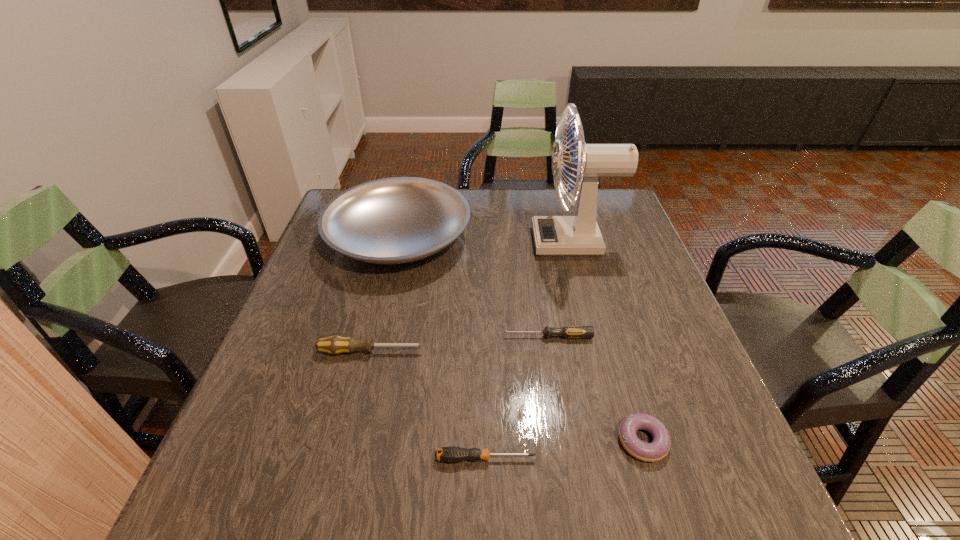
In the image, there is a desktop. At what (x,y) coordinates should I click in order to perform the action: click on vacant region at the near right corner. Please return your answer as a coordinate pair (x, y). The width and height of the screenshot is (960, 540). Looking at the image, I should click on (741, 496).

You are a GUI agent. You are given a task and a screenshot of the screen. Output one action in this format:
    pyautogui.click(x=<x>, y=<y>)
    Task: Click on the free spot between the doughnut and the tallest screwdriver
    The height and width of the screenshot is (540, 960).
    Given the screenshot: What is the action you would take?
    pyautogui.click(x=507, y=396)

I want to click on free spot between the fourth nearest object and the tallest object, so coord(561,289).

Locate an element on the screen. Image resolution: width=960 pixels, height=540 pixels. empty location between the doughnut and the nearest screwdriver is located at coordinates (564, 450).

Where is `free space that is in between the doughnut and the farthest screwdriver`? The image size is (960, 540). free space that is in between the doughnut and the farthest screwdriver is located at coordinates (595, 389).

Identify the location of free spot between the fourth shortest object and the farthest screwdriver. (460, 344).

Locate an element on the screen. This screenshot has width=960, height=540. empty space between the doughnut and the third tallest object is located at coordinates (507, 396).

Image resolution: width=960 pixels, height=540 pixels. I want to click on free space between the nearest screwdriver and the leftmost screwdriver, so click(x=428, y=405).

Find the location of a particular element. vacant space that's between the nearest screwdriver and the farthest screwdriver is located at coordinates (516, 397).

Locate an element on the screen. Image resolution: width=960 pixels, height=540 pixels. free space between the fourth nearest object and the leftmost screwdriver is located at coordinates (460, 344).